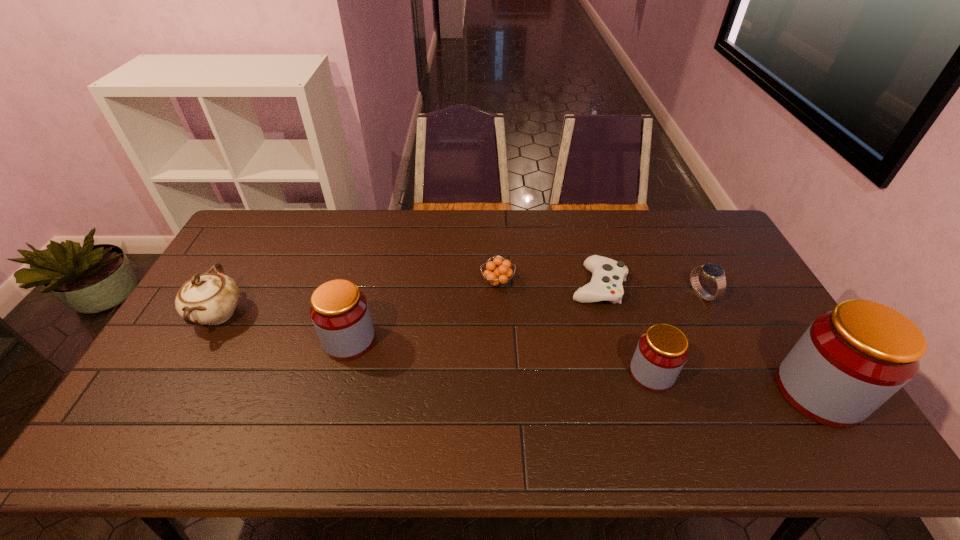
At what (x,y) coordinates should I click in order to perform the action: click on vacant area that satisfies the following two spatial constraints: 1. on the front side of the tallest object; 2. on the right side of the shortest jar. Please return your answer as a coordinate pair (x, y). The width and height of the screenshot is (960, 540). Looking at the image, I should click on (658, 392).

Where is `free space that satisfies the following two spatial constraints: 1. on the front side of the tallest jar; 2. on the right side of the orange fruit`? This screenshot has width=960, height=540. free space that satisfies the following two spatial constraints: 1. on the front side of the tallest jar; 2. on the right side of the orange fruit is located at coordinates (502, 392).

Identify the location of vacant space that satisfies the following two spatial constraints: 1. on the back side of the leftmost object; 2. on the right side of the third shortest object. (229, 294).